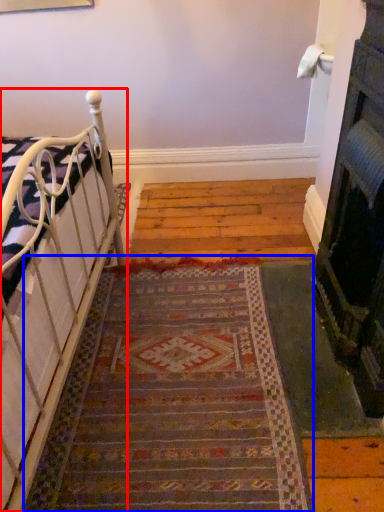
Question: Which of the following is the farthest to the observer, furniture (highlighted by a red box) or doormat (highlighted by a blue box)?

Choices:
 (A) furniture
 (B) doormat

Answer: (B)